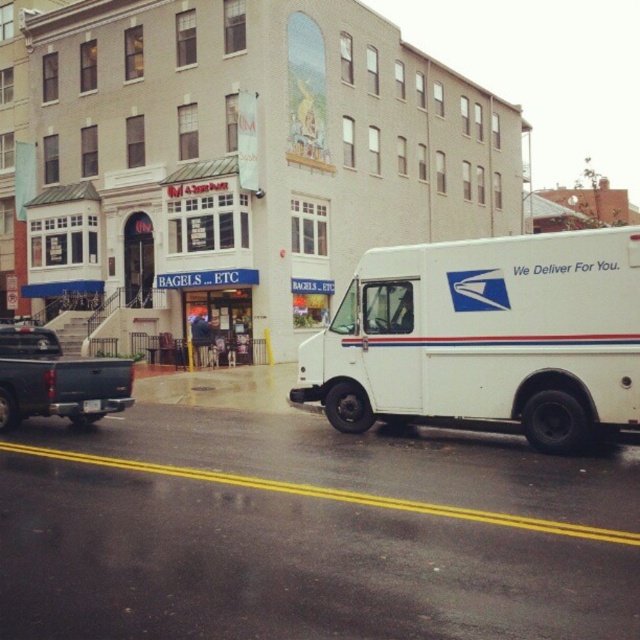
Question: Which object is positioned farthest from the white plastic license plate at center?

Choices:
 (A) matte black truck at left
 (B) white matte postal van at right

Answer: (B)

Question: From the image, what is the correct spatial relationship of white matte postal van at right in relation to white plastic license plate at center?

Choices:
 (A) below
 (B) above

Answer: (B)

Question: Does matte black truck at left have a smaller size compared to white plastic license plate at center?

Choices:
 (A) yes
 (B) no

Answer: (B)

Question: Does white matte postal van at right have a lesser width compared to matte black truck at left?

Choices:
 (A) yes
 (B) no

Answer: (B)

Question: Which point is closer to the camera?

Choices:
 (A) 86,403
 (B) 36,356

Answer: (A)

Question: Which object is positioned farthest from the matte black truck at left?

Choices:
 (A) white plastic license plate at center
 (B) white matte postal van at right

Answer: (B)